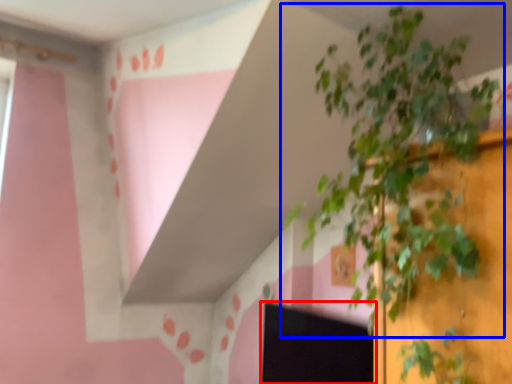
Question: Among these objects, which one is farthest to the camera, computer screen (highlighted by a red box) or houseplant (highlighted by a blue box)?

Choices:
 (A) computer screen
 (B) houseplant

Answer: (A)